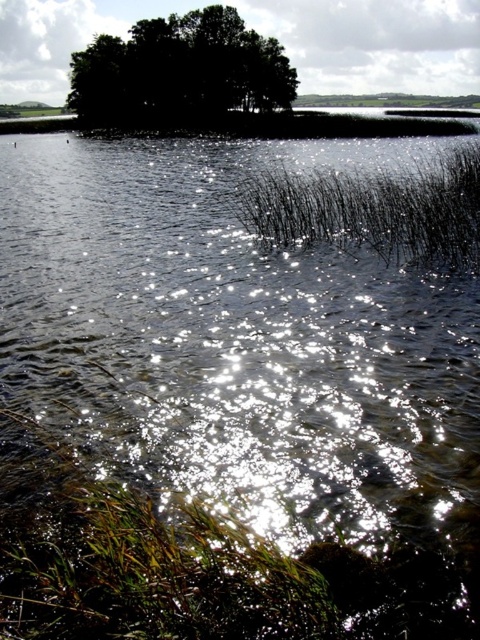
From the picture: You are a photographer planning to capture the reflection of the black matte reed at center and the dark green leafy trees at upper center in the water. Which object will have a larger reflection on the water surface?

The black matte reed at center is larger in size than the dark green leafy trees at upper center, so its reflection on the water surface will also be larger.

You are a photographer trying to capture the reflection of the water in the scene. You notice two points marked in the image at coordinates point (x=400, y=225) and point (x=265, y=106). Which point would you focus on to ensure the reflection is clearer?

Point (x=400, y=225) is closer to the camera than point (x=265, y=106), so focusing on point (x=400, y=225) would result in a clearer reflection because it is nearer to the camera.

You are standing at the edge of the water and see the black matte reed at center and the dark green leafy trees at upper center. Which object is positioned to the right of the other?

The black matte reed at center is to the right of dark green leafy trees at upper center.